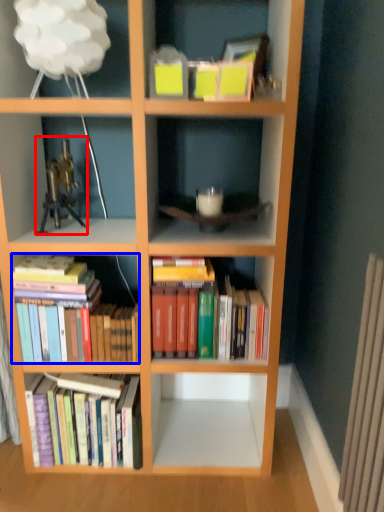
Question: Among these objects, which one is farthest to the camera, toy (highlighted by a red box) or book (highlighted by a blue box)?

Choices:
 (A) toy
 (B) book

Answer: (B)